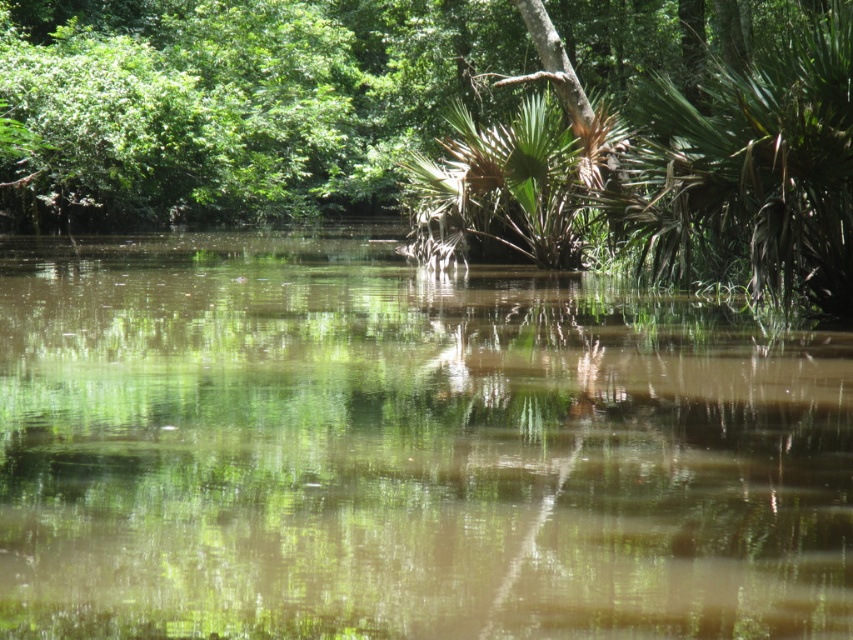
From the picture: You are standing at the edge of the green reflective water at center and want to look up at the green leafy tree at upper center. Which object will you see first as you tilt your head upward?

The green leafy tree at upper center will be seen first because it is positioned higher than the green reflective water at center, which is lower in the scene.

You are standing at the edge of the water and want to take a photo of both the green reflective water at center and the green leafy tree at upper center. Which object should you position to the left side of your camera frame to include both in the shot?

To include both the green reflective water at center and the green leafy tree at upper center in your photo, you should position the green leafy tree at upper center on the left side of your camera frame since the green reflective water at center is to the right of it.

You are standing at the edge of the green reflective water at center and want to throw a stone to create a ripple. If you can throw a stone 4 meters, will it land in the water?

The distance between you and the green reflective water at center is 3.88 meters. Since your throw can reach 4 meters, the stone will land in the water.